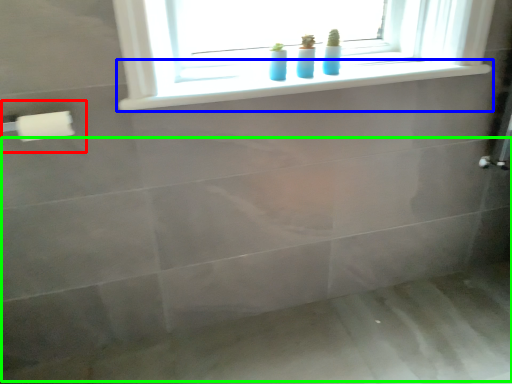
Question: Considering the real-world distances, which object is closest to towel bar (highlighted by a red box)? window sill (highlighted by a blue box) or bath (highlighted by a green box).

Choices:
 (A) window sill
 (B) bath

Answer: (A)